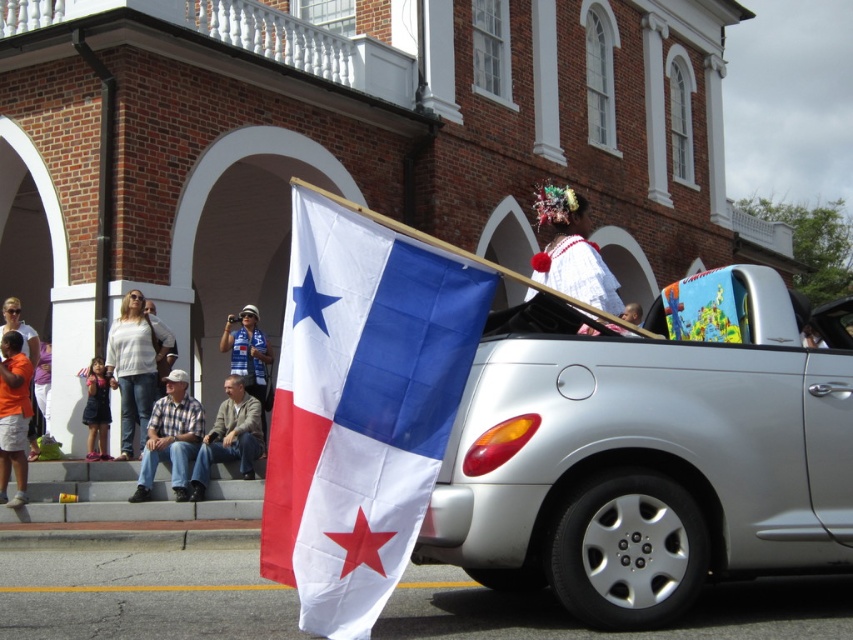
You are a photographer standing in the middle of the street. You want to take a photo of the silver metallic car at center and the light brown leather jacket at lower center. Which object should you move closer to first to ensure both are in frame?

You should move closer to the light brown leather jacket at lower center first because the silver metallic car at center is positioned on the right side of it, so adjusting your position relative to the jacket will help frame both objects together.

You are standing at the parade and want to take a photo of the flag and the car. The flag is at point [183,408] and the car is at point [96,394]. Which point is closer to you so you can focus your camera first?

Point [183,408] is closer to the viewer than point [96,394], so you should focus your camera on the flag first.